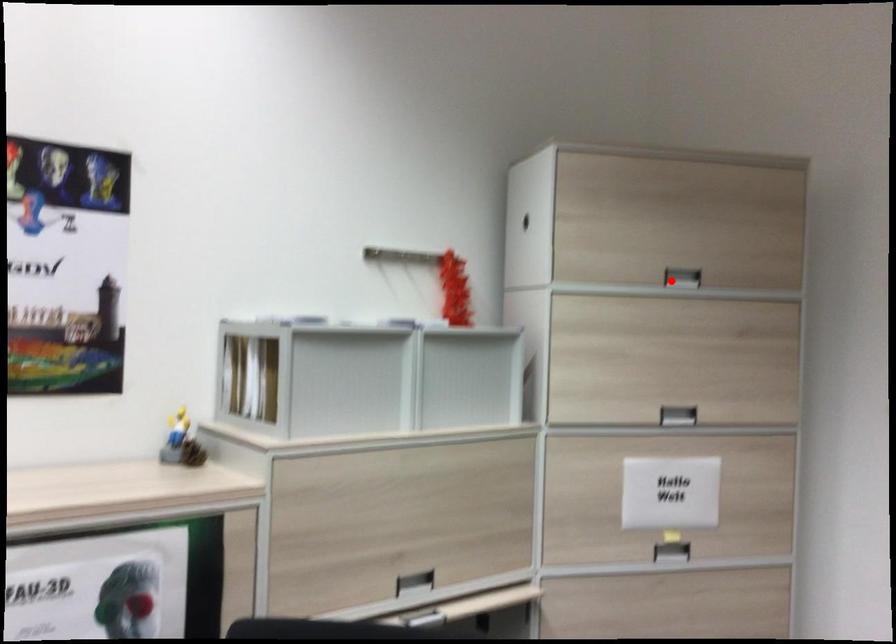
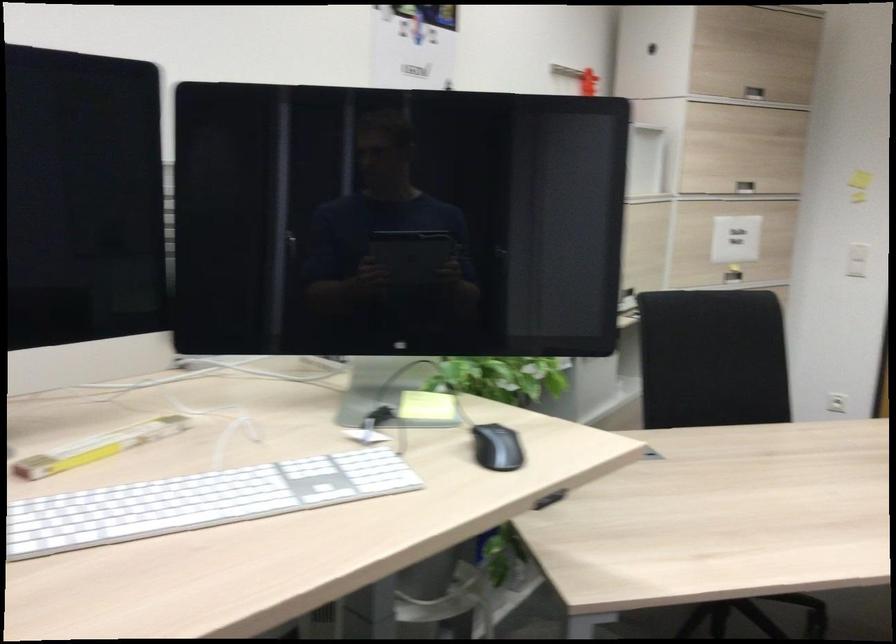
Question: A red point is marked in image1. In image2, is the corresponding 3D point closer to the camera or farther? Reply with the corresponding letter.

Choices:
 (A) The corresponding 3D point is closer.
 (B) The corresponding 3D point is farther.

Answer: (B)